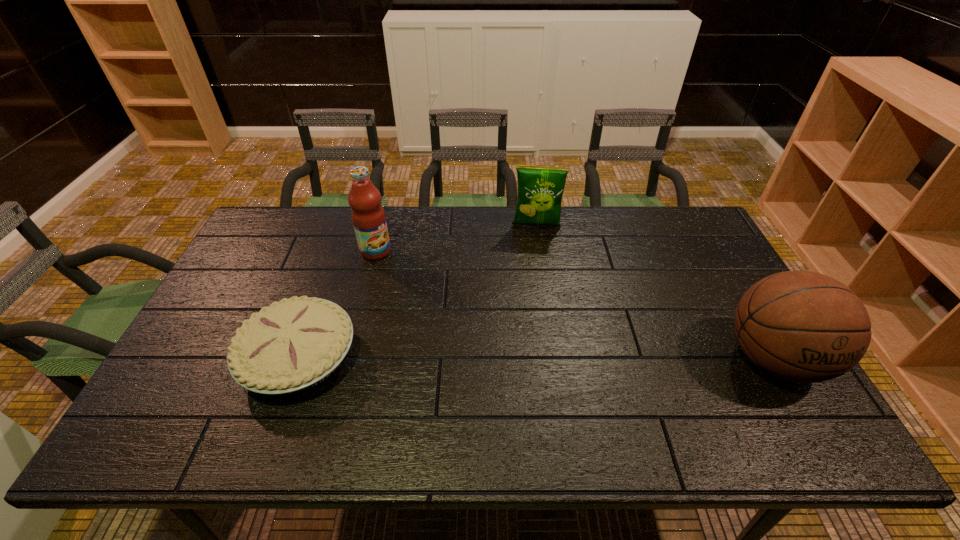
Locate an element on the screen. blank space at the far edge of the desktop is located at coordinates (426, 238).

The height and width of the screenshot is (540, 960). In the image, there is a desktop. What are the coordinates of `blank space at the near edge` in the screenshot? It's located at (515, 396).

Locate an element on the screen. vacant region at the left edge is located at coordinates (247, 312).

Where is `free spot at the right edge of the desktop`? The image size is (960, 540). free spot at the right edge of the desktop is located at coordinates (689, 295).

Image resolution: width=960 pixels, height=540 pixels. In order to click on free space at the far left corner of the desktop in this screenshot , I will do `click(245, 248)`.

Where is `free space between the second farthest object and the basketball`? free space between the second farthest object and the basketball is located at coordinates 574,305.

At what (x,y) coordinates should I click in order to perform the action: click on empty space between the shortest object and the fruit juice. Please return your answer as a coordinate pair (x, y). This screenshot has height=540, width=960. Looking at the image, I should click on (337, 304).

This screenshot has height=540, width=960. Identify the location of free space between the basketball and the shortest object. (536, 357).

Locate an element on the screen. empty location between the rightmost object and the third object from left to right is located at coordinates (655, 293).

At what (x,y) coordinates should I click in order to perform the action: click on unoccupied area between the fruit juice and the farthest object. Please return your answer as a coordinate pair (x, y). This screenshot has width=960, height=540. Looking at the image, I should click on (456, 239).